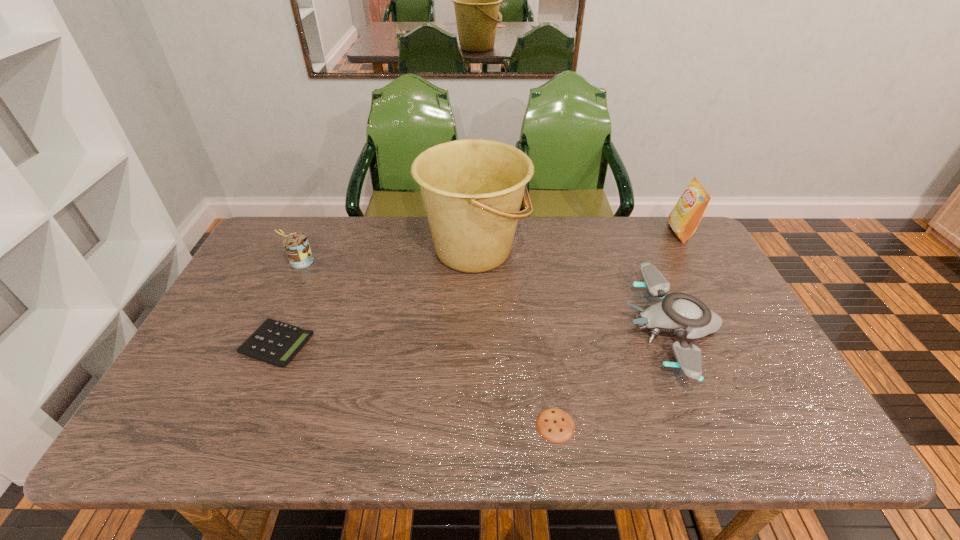
Locate an element on the screen. vacant space located 0.260m on the front-facing side of the second tallest object is located at coordinates (593, 233).

Identify the location of free space located 0.400m on the front-facing side of the second tallest object. (553, 233).

I want to click on vacant region located on the front-facing side of the second tallest object, so click(576, 233).

Where is `vacant space located on the front of the third tallest object`? The width and height of the screenshot is (960, 540). vacant space located on the front of the third tallest object is located at coordinates (279, 307).

Find the location of `free point located 0.110m on the front-facing side of the second object from right to left`. free point located 0.110m on the front-facing side of the second object from right to left is located at coordinates (584, 328).

You are a GUI agent. You are given a task and a screenshot of the screen. Output one action in this format:
    pyautogui.click(x=<x>, y=<y>)
    Task: Click on the free space located on the front-facing side of the second object from right to left
    The height and width of the screenshot is (540, 960).
    Given the screenshot: What is the action you would take?
    pyautogui.click(x=485, y=328)

The height and width of the screenshot is (540, 960). I want to click on vacant region located on the front-facing side of the second object from right to left, so click(x=540, y=328).

The width and height of the screenshot is (960, 540). In order to click on vacant space situated 0.330m on the right of the calculator in this screenshot , I will do `click(437, 344)`.

The height and width of the screenshot is (540, 960). I want to click on free point located 0.120m on the left of the cookie, so click(x=483, y=425).

Identify the location of bucket that is positioned at the far edge. Image resolution: width=960 pixels, height=540 pixels. (472, 189).